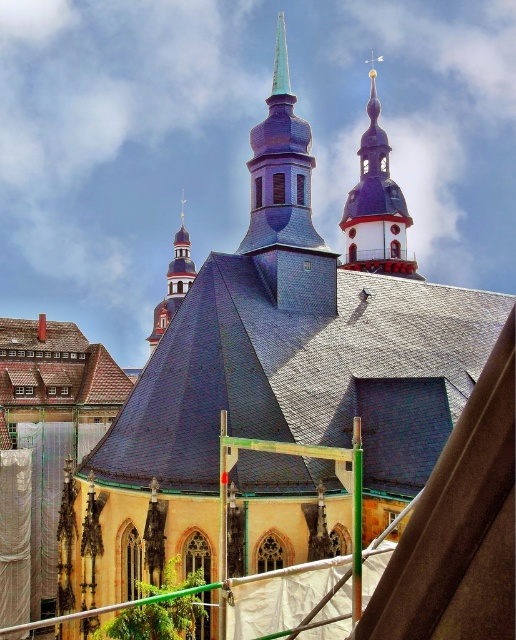
Question: Does purple matte steeple at upper center have a greater width compared to smooth red wood spire at upper left?

Choices:
 (A) no
 (B) yes

Answer: (B)

Question: Which point is closer to the camera taking this photo?

Choices:
 (A) (183, 289)
 (B) (346, 259)

Answer: (B)

Question: In this image, where is purple matte steeple at upper center located relative to smooth red wood spire at upper left?

Choices:
 (A) right
 (B) left

Answer: (A)

Question: Does purple matte steeple at upper center have a smaller size compared to smooth red wood spire at upper left?

Choices:
 (A) no
 (B) yes

Answer: (A)

Question: Which point appears closest to the camera in this image?

Choices:
 (A) (172, 275)
 (B) (378, 196)

Answer: (B)

Question: Which object is closer to the camera taking this photo?

Choices:
 (A) purple matte steeple at upper center
 (B) smooth red wood spire at upper left

Answer: (A)